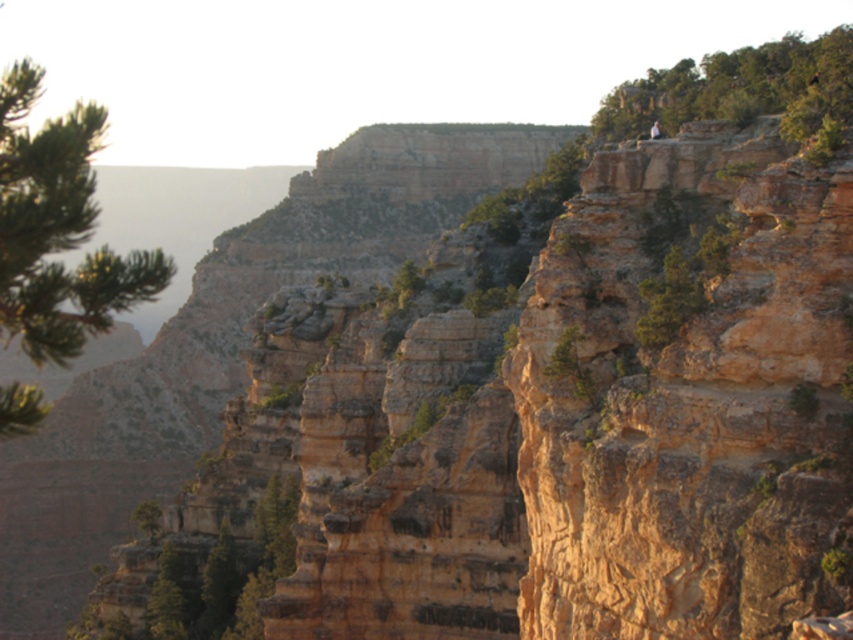
Question: Is green textured pine tree at left above green leafy tree at upper right?

Choices:
 (A) no
 (B) yes

Answer: (A)

Question: Which point is farther from the camera taking this photo?

Choices:
 (A) (57, 333)
 (B) (647, 115)

Answer: (B)

Question: From the image, what is the correct spatial relationship of green textured pine tree at left in relation to green leafy tree at upper right?

Choices:
 (A) left
 (B) right

Answer: (A)

Question: Which point is closer to the camera taking this photo?

Choices:
 (A) (10, 234)
 (B) (602, 113)

Answer: (A)

Question: Which point is closer to the camera taking this photo?

Choices:
 (A) (810, 132)
 (B) (76, 320)

Answer: (B)

Question: Is the position of green textured pine tree at left more distant than that of green leafy tree at upper right?

Choices:
 (A) yes
 (B) no

Answer: (B)